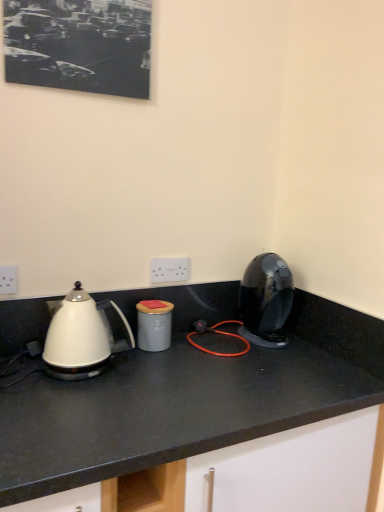
Find the location of a particular element. vacant area in front of gray matte canister at center is located at coordinates (156, 367).